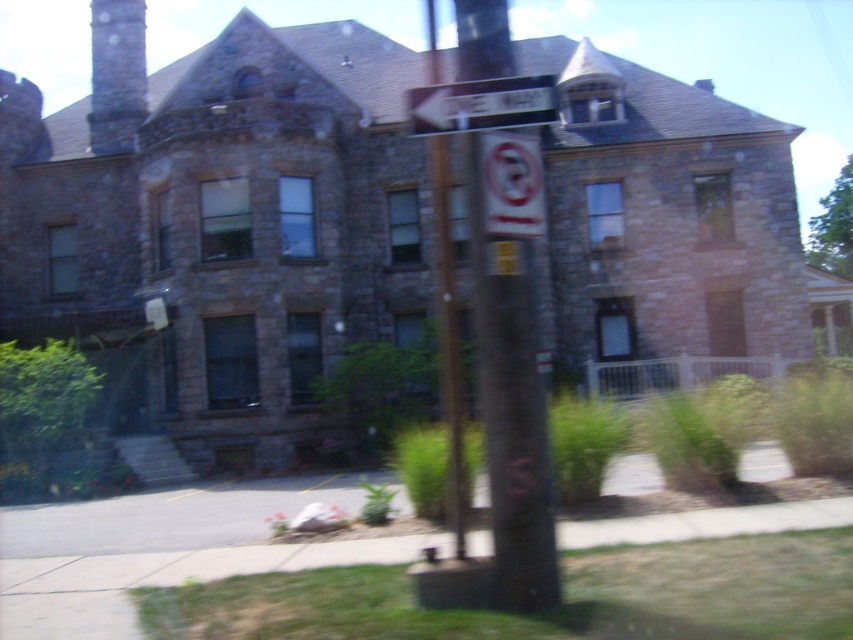
Question: Can you confirm if dark brown wood post at center is smaller than white plastic sign at upper center?

Choices:
 (A) yes
 (B) no

Answer: (B)

Question: Which point is closer to the camera taking this photo?

Choices:
 (A) (488, 288)
 (B) (534, 92)

Answer: (A)

Question: Which point is farther from the camera taking this photo?

Choices:
 (A) (498, 554)
 (B) (509, 108)

Answer: (B)

Question: Can you confirm if dark brown wood post at center is positioned below white plastic sign at upper center?

Choices:
 (A) yes
 (B) no

Answer: (A)

Question: Does dark brown wood post at center have a lesser width compared to white plastic sign at upper center?

Choices:
 (A) no
 (B) yes

Answer: (A)

Question: Among these objects, which one is nearest to the camera?

Choices:
 (A) white plastic sign at upper center
 (B) dark brown wood post at center

Answer: (B)